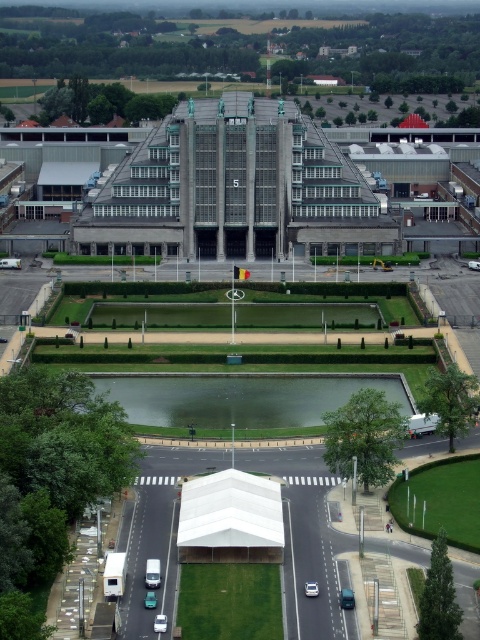
Question: Is white glossy car at lower center behind metallic silver car at lower center?

Choices:
 (A) yes
 (B) no

Answer: (B)

Question: Can you confirm if white glossy car at center is smaller than metallic silver car at lower center?

Choices:
 (A) no
 (B) yes

Answer: (A)

Question: Can you confirm if white glossy car at lower center is bigger than white glossy car at center?

Choices:
 (A) no
 (B) yes

Answer: (B)

Question: Among these objects, which one is nearest to the camera?

Choices:
 (A) white glossy car at center
 (B) metallic silver van at center
 (C) white glossy car at lower center
 (D) teal matte car at center

Answer: (C)

Question: Which object is farther from the camera taking this photo?

Choices:
 (A) teal matte car at center
 (B) white glossy car at center
 (C) white glossy car at lower center

Answer: (B)

Question: Among these objects, which one is nearest to the camera?

Choices:
 (A) white glossy car at lower center
 (B) white glossy car at center
 (C) metallic silver van at center
 (D) metallic silver car at lower center

Answer: (A)